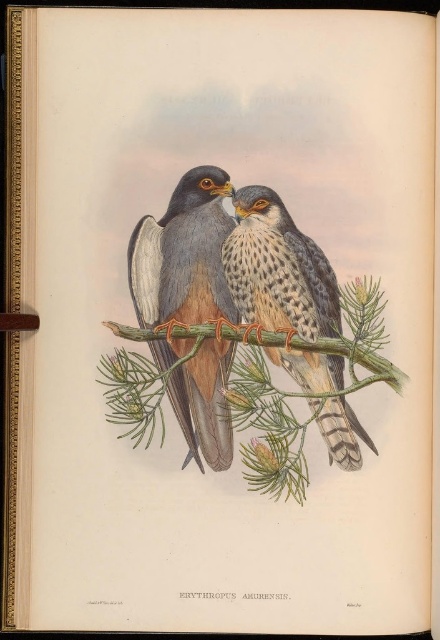
Question: Which point is closer to the camera?

Choices:
 (A) speckled feathered falcon at center
 (B) matte blue-gray falcon at center

Answer: (B)

Question: Does matte blue-gray falcon at center appear on the left side of speckled feathered falcon at center?

Choices:
 (A) yes
 (B) no

Answer: (A)

Question: Is matte blue-gray falcon at center thinner than speckled feathered falcon at center?

Choices:
 (A) yes
 (B) no

Answer: (A)

Question: Which point is closer to the camera?

Choices:
 (A) (135, 243)
 (B) (289, 301)

Answer: (A)

Question: Does matte blue-gray falcon at center appear on the right side of speckled feathered falcon at center?

Choices:
 (A) no
 (B) yes

Answer: (A)